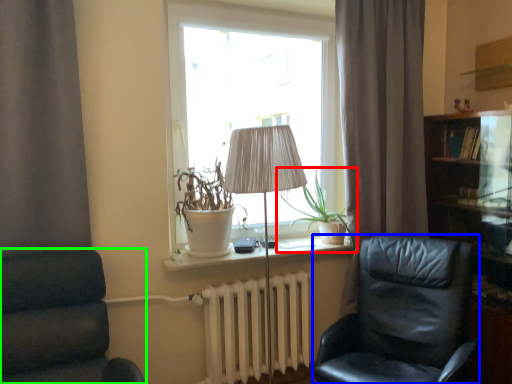
Question: Which object is the closest to the plant (highlighted by a red box)? Choose among these: chair (highlighted by a blue box) or chair (highlighted by a green box).

Choices:
 (A) chair
 (B) chair

Answer: (A)